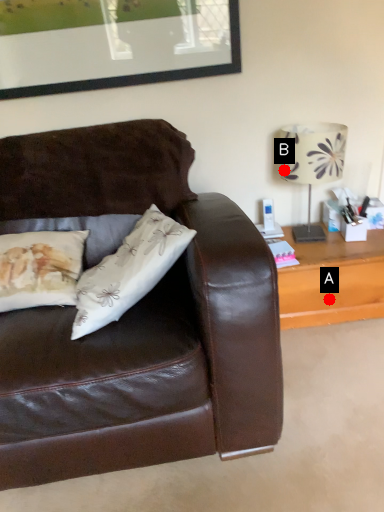
Question: Two points are circled on the image, labeled by A and B beside each circle. Which point appears farthest from the camera in this image?

Choices:
 (A) A is further
 (B) B is further

Answer: (A)